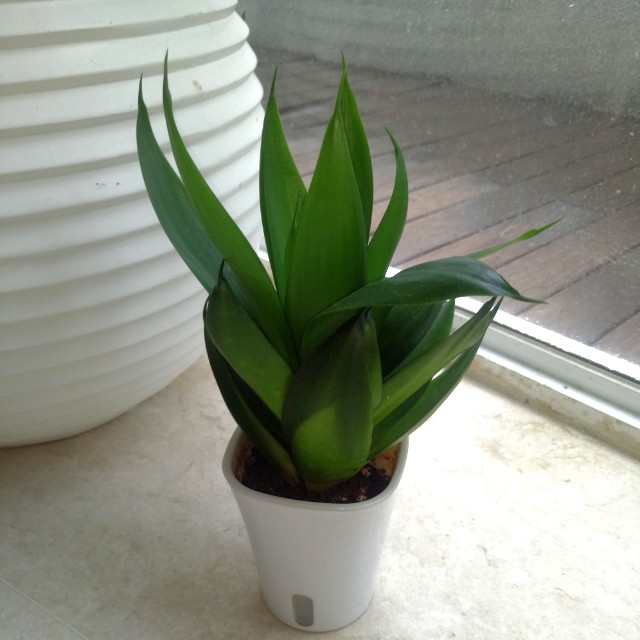
This screenshot has width=640, height=640. In order to click on white marble flooring in this screenshot , I will do `click(162, 550)`.